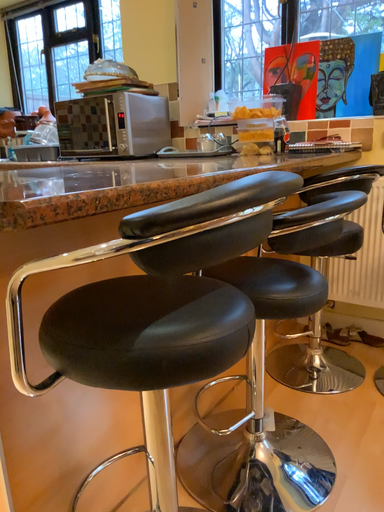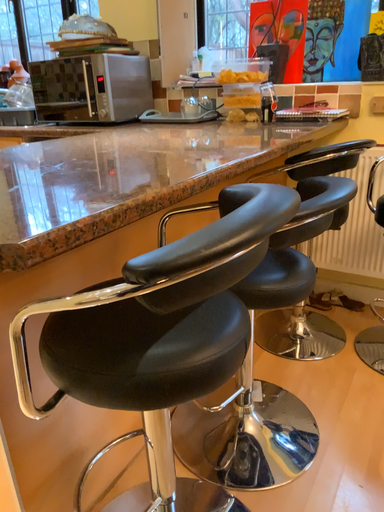
Question: Which way did the camera rotate in the video?

Choices:
 (A) rotated downward
 (B) rotated upward

Answer: (A)